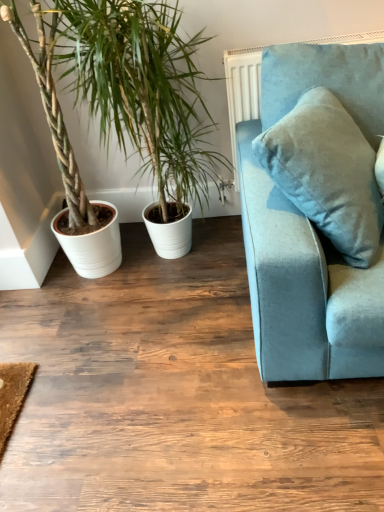
At what (x,y) coordinates should I click in order to perform the action: click on free space in front of white ceramic plant at left. Please return your answer as a coordinate pair (x, y). This screenshot has width=384, height=512. Looking at the image, I should click on point(179,315).